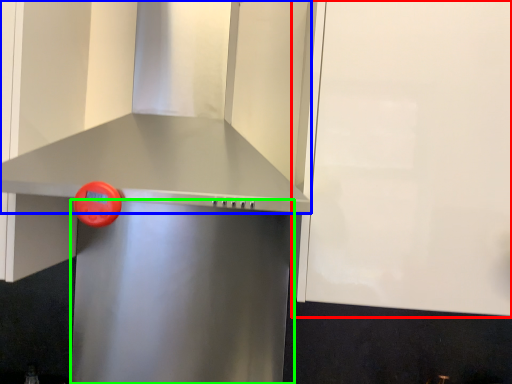
Question: Estimate the real-world distances between objects in this image. Which object is farther from cabinetry (highlighted by a red box), vent (highlighted by a blue box) or appliance (highlighted by a green box)?

Choices:
 (A) vent
 (B) appliance

Answer: (B)